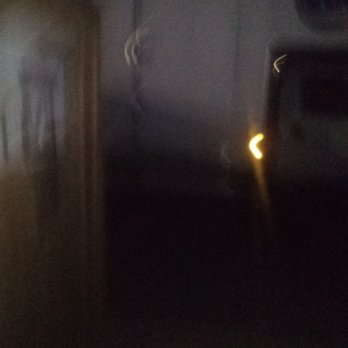
Locate an element on the screen. black middle of brown door is located at coordinates (49, 185).